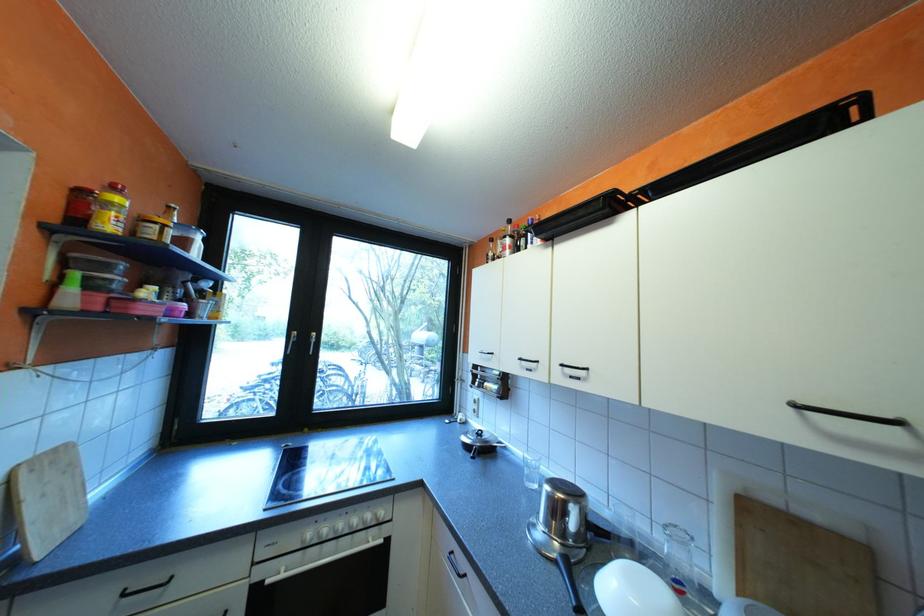
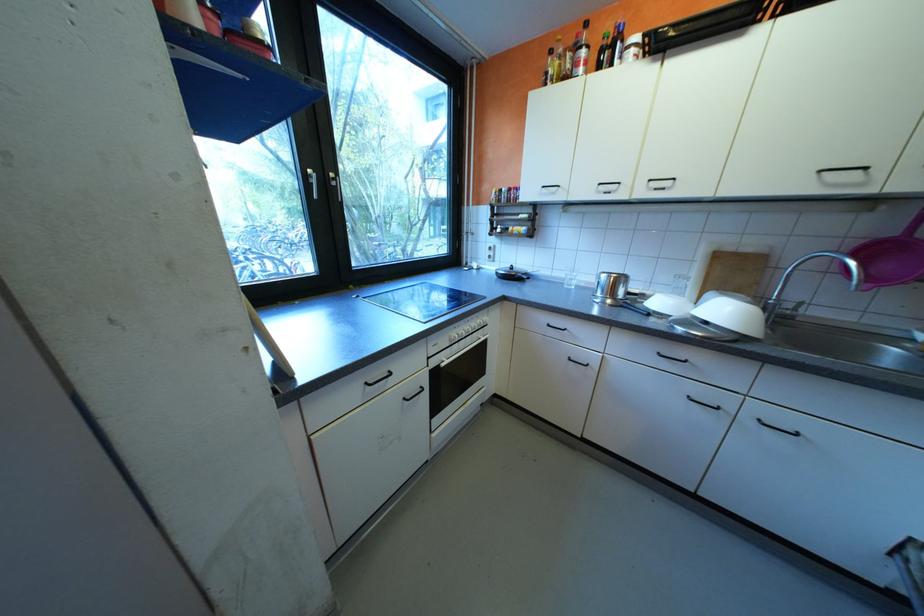
Where in the second image is the point corresponding to the point at 301,537 from the first image?

(455, 339)